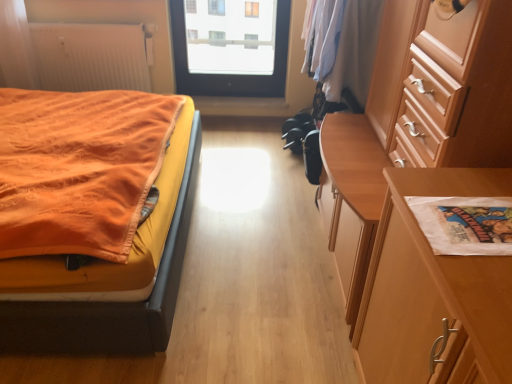
Where is `vacant space underneath white paper at right (from a real-world perspective)`? vacant space underneath white paper at right (from a real-world perspective) is located at coordinates (462, 235).